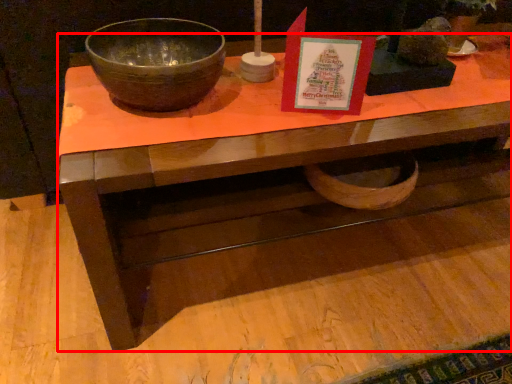
Question: From the image's perspective, what is the correct spatial relationship of desk (annotated by the red box) in relation to bowl?

Choices:
 (A) above
 (B) below

Answer: (B)